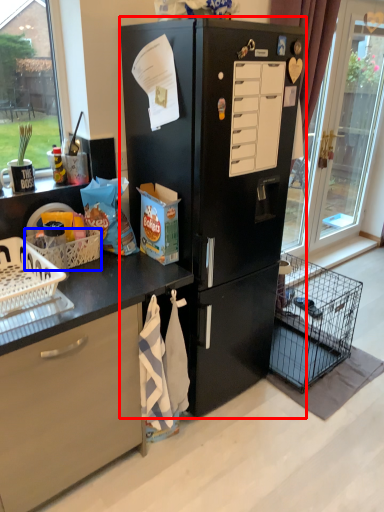
Question: Which object is closer to the camera taking this photo, refrigerator (highlighted by a red box) or basket (highlighted by a blue box)?

Choices:
 (A) refrigerator
 (B) basket

Answer: (A)